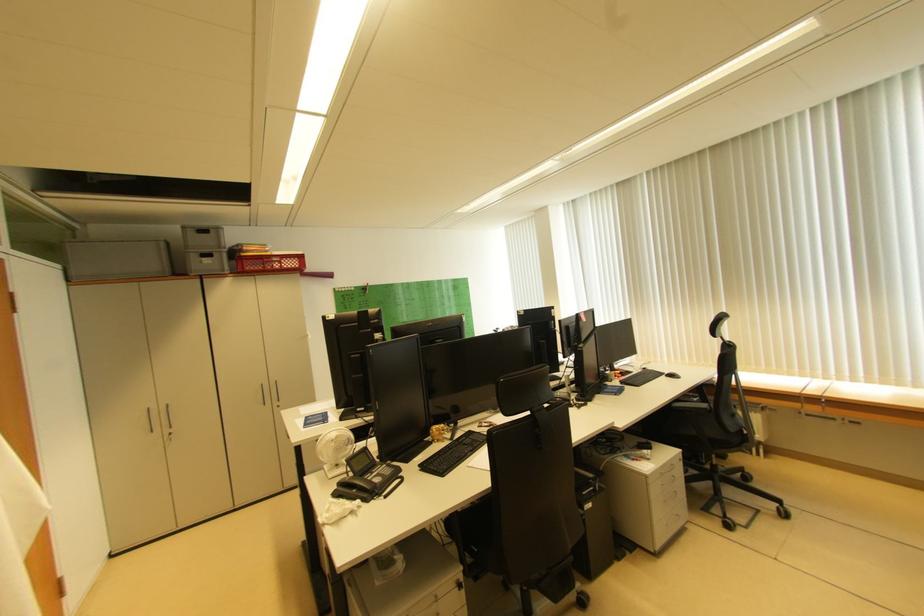
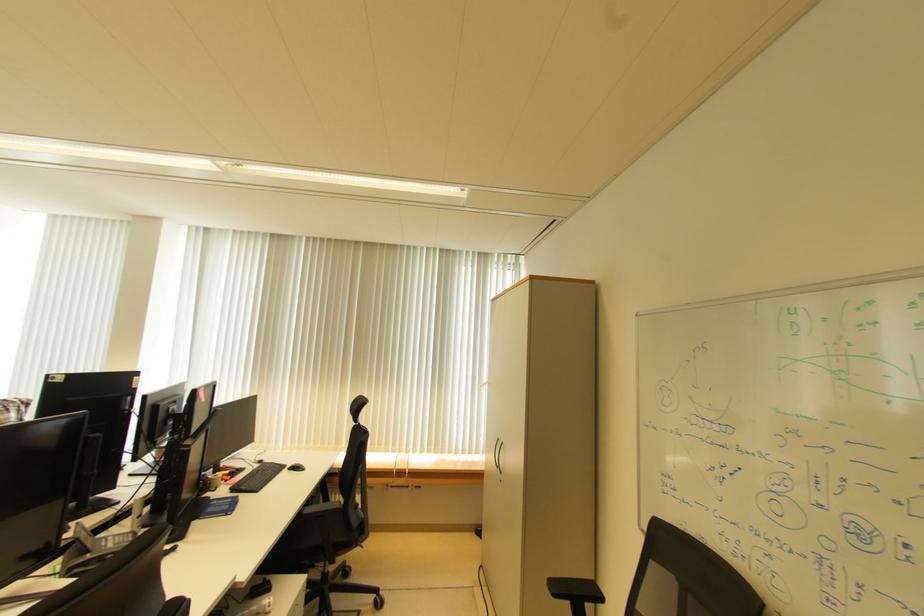
In the second image, find the point that corresponds to point 673,378 in the first image.

(295, 471)